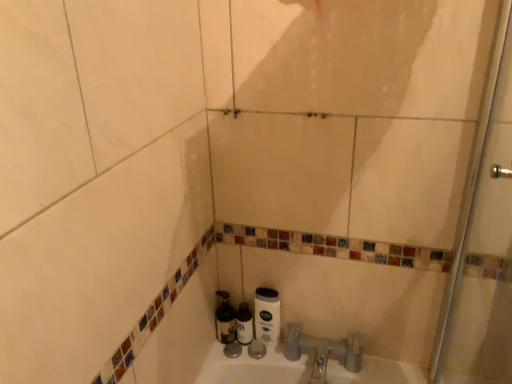
Question: Is translucent plastic bottle at center, the first bottle positioned from the right, completely or partially outside of metallic silver bottle at lower center, which ranks as the 1th bottle in left-to-right order?

Choices:
 (A) no
 (B) yes

Answer: (B)

Question: Would you consider translucent plastic bottle at center, the 2th bottle positioned from the left, to be distant from metallic silver bottle at lower center, the 2th bottle positioned from the right?

Choices:
 (A) no
 (B) yes

Answer: (A)

Question: Is translucent plastic bottle at center, the first bottle positioned from the right, at the left side of metallic silver bottle at lower center, which ranks as the 1th bottle in left-to-right order?

Choices:
 (A) yes
 (B) no

Answer: (B)

Question: Is translucent plastic bottle at center, the 2th bottle positioned from the left, in contact with metallic silver bottle at lower center, the 2th bottle positioned from the right?

Choices:
 (A) no
 (B) yes

Answer: (B)

Question: From a real-world perspective, is translucent plastic bottle at center, the first bottle positioned from the right, physically below metallic silver bottle at lower center, which ranks as the 1th bottle in left-to-right order?

Choices:
 (A) yes
 (B) no

Answer: (A)

Question: Does point (278, 311) appear closer or farther from the camera than point (239, 304)?

Choices:
 (A) closer
 (B) farther

Answer: (A)

Question: Is white matte toilet paper at lower center taller or shorter than translucent plastic bottle at center, the 2th bottle positioned from the left?

Choices:
 (A) tall
 (B) short

Answer: (A)

Question: In the image, is white matte toilet paper at lower center positioned in front of or behind translucent plastic bottle at center, the 2th bottle positioned from the left?

Choices:
 (A) front
 (B) behind

Answer: (A)

Question: Considering the relative positions of white matte toilet paper at lower center and translucent plastic bottle at center, the 2th bottle positioned from the left, in the image provided, is white matte toilet paper at lower center to the left or to the right of translucent plastic bottle at center, the 2th bottle positioned from the left,?

Choices:
 (A) right
 (B) left

Answer: (A)

Question: From their relative heights in the image, would you say translucent plastic bottle at center, the 2th bottle positioned from the left, is taller or shorter than transparent glass shower door at right?

Choices:
 (A) short
 (B) tall

Answer: (A)

Question: Is translucent plastic bottle at center, the 2th bottle positioned from the left, in front of or behind transparent glass shower door at right in the image?

Choices:
 (A) behind
 (B) front

Answer: (A)

Question: Is translucent plastic bottle at center, the first bottle positioned from the right, bigger or smaller than transparent glass shower door at right?

Choices:
 (A) small
 (B) big

Answer: (A)

Question: Does point (242, 314) appear closer or farther from the camera than point (484, 370)?

Choices:
 (A) farther
 (B) closer

Answer: (A)

Question: From a real-world perspective, relative to metallic silver bottle at lower center, which ranks as the 1th bottle in left-to-right order, is translucent plastic bottle at center, the first bottle positioned from the right, vertically above or below?

Choices:
 (A) above
 (B) below

Answer: (B)

Question: From the image's perspective, is translucent plastic bottle at center, the 2th bottle positioned from the left, positioned above or below metallic silver bottle at lower center, the 2th bottle positioned from the right?

Choices:
 (A) below
 (B) above

Answer: (A)